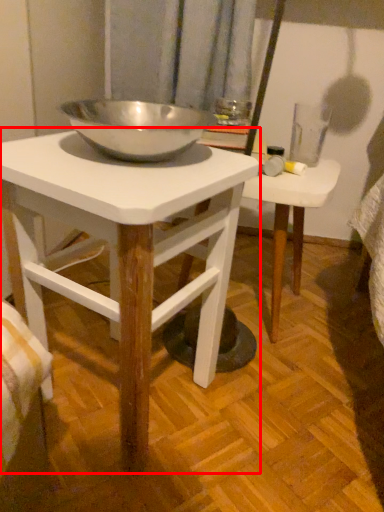
Question: From the image's perspective, what is the correct spatial positioning of table (annotated by the red box) in reference to table?

Choices:
 (A) below
 (B) above

Answer: (A)